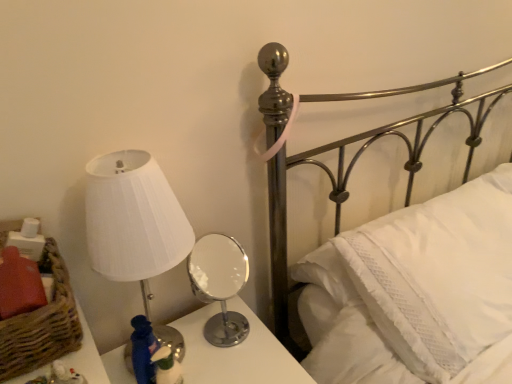
Question: Can you confirm if white pleated fabric lampshade at left is positioned to the right of metallic silver bed at upper right?

Choices:
 (A) yes
 (B) no

Answer: (B)

Question: Is white pleated fabric lampshade at left in front of metallic silver bed at upper right?

Choices:
 (A) yes
 (B) no

Answer: (B)

Question: Is there a large distance between white pleated fabric lampshade at left and metallic silver bed at upper right?

Choices:
 (A) no
 (B) yes

Answer: (A)

Question: From a real-world perspective, does white pleated fabric lampshade at left sit lower than metallic silver bed at upper right?

Choices:
 (A) yes
 (B) no

Answer: (B)

Question: Is white pleated fabric lampshade at left wider than metallic silver bed at upper right?

Choices:
 (A) no
 (B) yes

Answer: (A)

Question: Visually, is polished chrome mirror at center positioned to the left or to the right of metallic silver table lamp at center?

Choices:
 (A) right
 (B) left

Answer: (B)

Question: From a real-world perspective, relative to metallic silver table lamp at center, is polished chrome mirror at center vertically above or below?

Choices:
 (A) below
 (B) above

Answer: (A)

Question: Does point (227, 369) appear closer or farther from the camera than point (234, 339)?

Choices:
 (A) closer
 (B) farther

Answer: (A)

Question: Is polished chrome mirror at center in front of or behind metallic silver table lamp at center in the image?

Choices:
 (A) behind
 (B) front

Answer: (B)

Question: Is brown woven basket at lower left taller or shorter than white pleated fabric lampshade at left?

Choices:
 (A) tall
 (B) short

Answer: (B)

Question: Is brown woven basket at lower left bigger or smaller than white pleated fabric lampshade at left?

Choices:
 (A) small
 (B) big

Answer: (A)

Question: From a real-world perspective, is brown woven basket at lower left above or below white pleated fabric lampshade at left?

Choices:
 (A) below
 (B) above

Answer: (B)

Question: Considering the positions of brown woven basket at lower left and white pleated fabric lampshade at left in the image, is brown woven basket at lower left wider or thinner than white pleated fabric lampshade at left?

Choices:
 (A) thin
 (B) wide

Answer: (A)

Question: From a real-world perspective, relative to brown woven basket at lower left, is polished chrome mirror at center vertically above or below?

Choices:
 (A) above
 (B) below

Answer: (B)

Question: Is polished chrome mirror at center bigger or smaller than brown woven basket at lower left?

Choices:
 (A) small
 (B) big

Answer: (B)